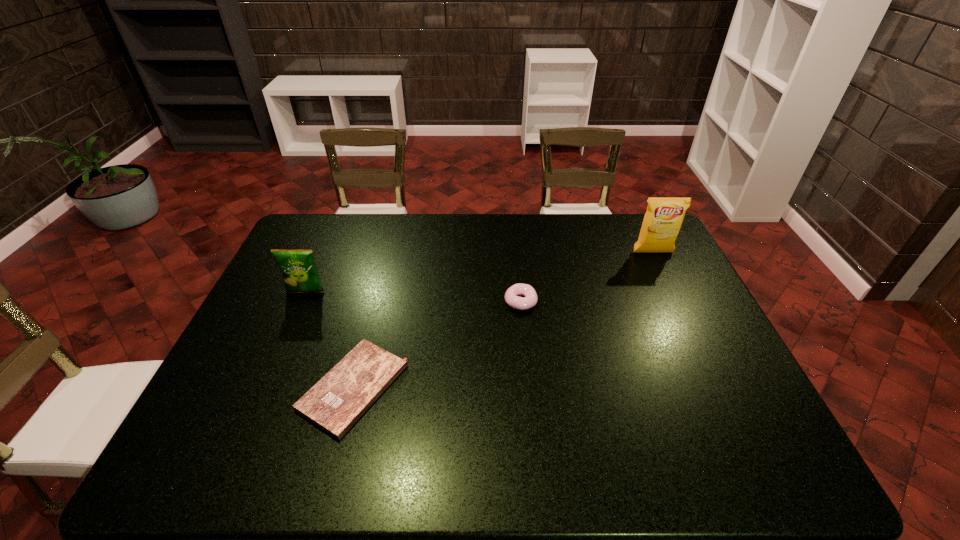
Where is `the rightmost object`? The image size is (960, 540). the rightmost object is located at coordinates (664, 216).

I want to click on the farthest object, so click(664, 216).

I want to click on the shorter crisp (potato chip), so click(299, 271).

Where is `the left crisp (potato chip)`? The width and height of the screenshot is (960, 540). the left crisp (potato chip) is located at coordinates (299, 271).

Locate an element on the screen. The width and height of the screenshot is (960, 540). the second object from right to left is located at coordinates (511, 297).

This screenshot has height=540, width=960. I want to click on the second shortest object, so click(x=511, y=297).

Identify the location of the nearest object. Image resolution: width=960 pixels, height=540 pixels. (335, 403).

Identify the location of the second object from left to right. Image resolution: width=960 pixels, height=540 pixels. (335, 403).

Find the location of a particular element. The height and width of the screenshot is (540, 960). vacant space located on the front of the farther crisp (potato chip) with the logo is located at coordinates (671, 291).

At what (x,y) coordinates should I click in order to perform the action: click on vacant space situated on the front-facing side of the leftmost object. Please return your answer as a coordinate pair (x, y). The width and height of the screenshot is (960, 540). Looking at the image, I should click on (266, 384).